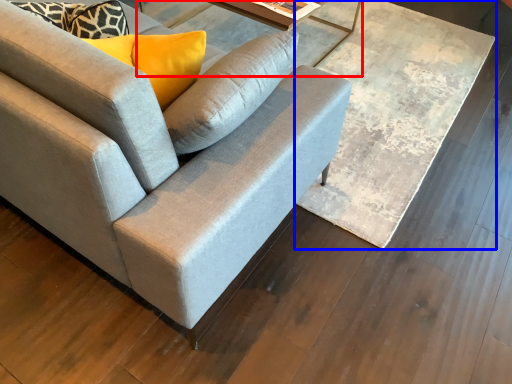
Question: Which object appears closest to the camera in this image, round table (highlighted by a red box) or table (highlighted by a blue box)?

Choices:
 (A) round table
 (B) table

Answer: (B)